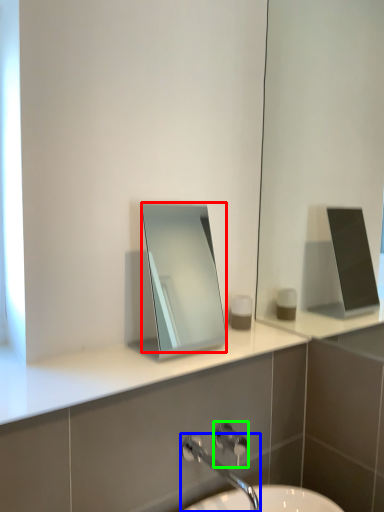
Question: Considering the real-world distances, which object is closest to mirror (highlighted by a red box)? tap (highlighted by a blue box) or shower (highlighted by a green box).

Choices:
 (A) tap
 (B) shower

Answer: (A)